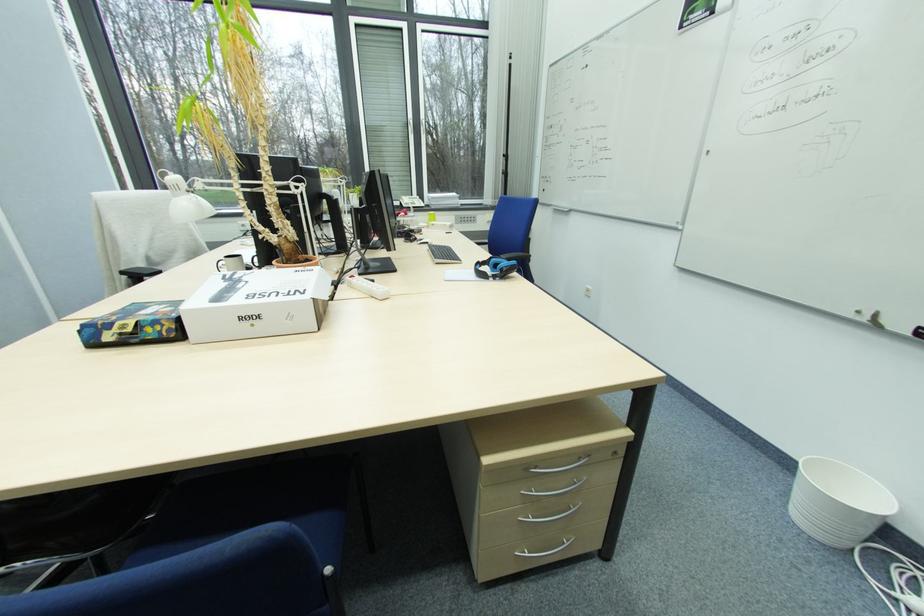
Describe the element at coordinates (185, 200) in the screenshot. I see `the white lamp head` at that location.